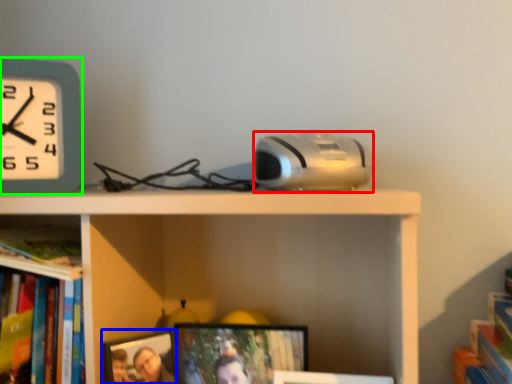
Question: Estimate the real-world distances between objects in this image. Which object is closer to gadget (highlighted by a red box), picture frame (highlighted by a blue box) or wall clock (highlighted by a green box)?

Choices:
 (A) picture frame
 (B) wall clock

Answer: (A)